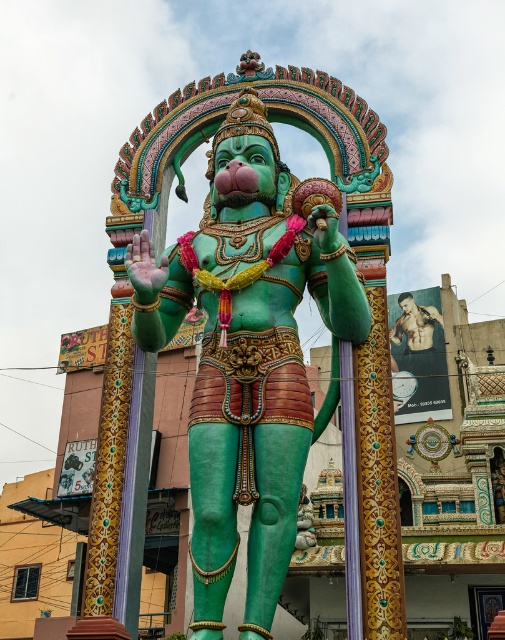
Question: Is green glossy statue at center to the left of muscular skin torso at right from the viewer's perspective?

Choices:
 (A) yes
 (B) no

Answer: (A)

Question: Can you confirm if green glossy statue at center is bigger than muscular skin torso at right?

Choices:
 (A) no
 (B) yes

Answer: (B)

Question: Which point is farther to the camera?

Choices:
 (A) (189, 468)
 (B) (413, 296)

Answer: (B)

Question: In this image, where is green glossy statue at center located relative to muscular skin torso at right?

Choices:
 (A) left
 (B) right

Answer: (A)